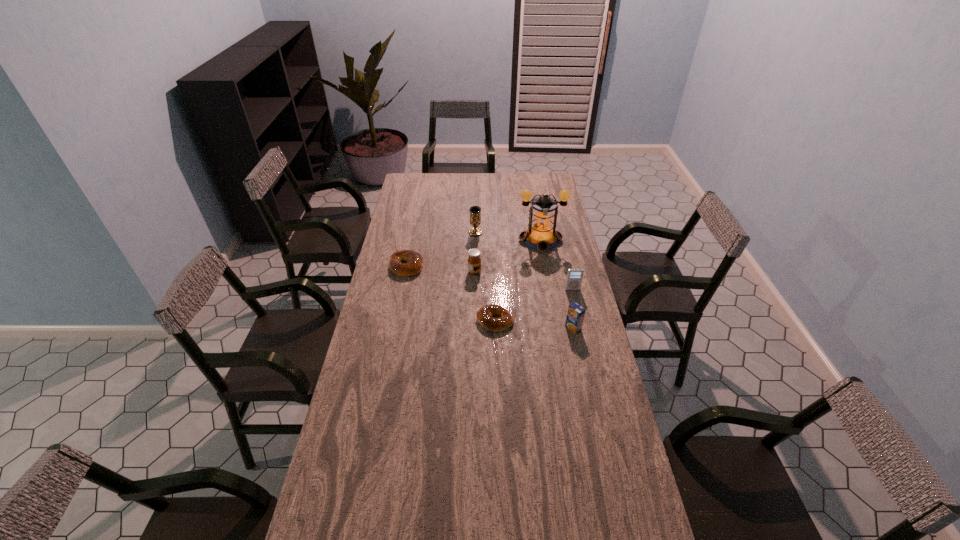
Where is `the farther bagel`? Image resolution: width=960 pixels, height=540 pixels. the farther bagel is located at coordinates (414, 260).

Image resolution: width=960 pixels, height=540 pixels. Find the location of `the left bagel`. the left bagel is located at coordinates point(414,260).

You are a GUI agent. You are given a task and a screenshot of the screen. Output one action in this format:
    pyautogui.click(x=<x>, y=<y>)
    Task: Click on the right bagel
    The image size is (960, 540).
    Given the screenshot: What is the action you would take?
    pyautogui.click(x=484, y=315)

Locate an element on the screen. The image size is (960, 540). the shorter bagel is located at coordinates (484, 315).

This screenshot has width=960, height=540. In order to click on lantern in this screenshot , I will do `click(541, 235)`.

Identify the location of chalice. (475, 211).

Image resolution: width=960 pixels, height=540 pixels. What are the coordinates of `honey` in the screenshot? It's located at (474, 261).

I want to click on the fifth farthest object, so click(x=574, y=276).

In order to click on orange_juice in this screenshot , I will do `click(575, 315)`.

What are the coordinates of `vacant space located on the front of the leftmost object` in the screenshot? It's located at (396, 318).